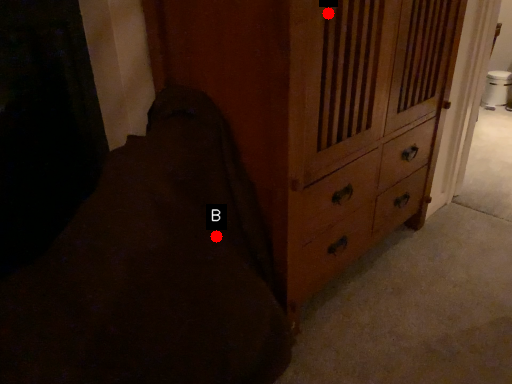
Question: Two points are circled on the image, labeled by A and B beside each circle. Among these points, which one is nearest to the camera?

Choices:
 (A) A is closer
 (B) B is closer

Answer: (A)